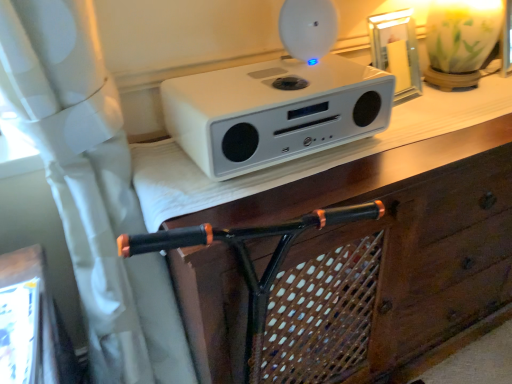
Where is `vacant space in front of white matte speaker at upper center`? vacant space in front of white matte speaker at upper center is located at coordinates (268, 188).